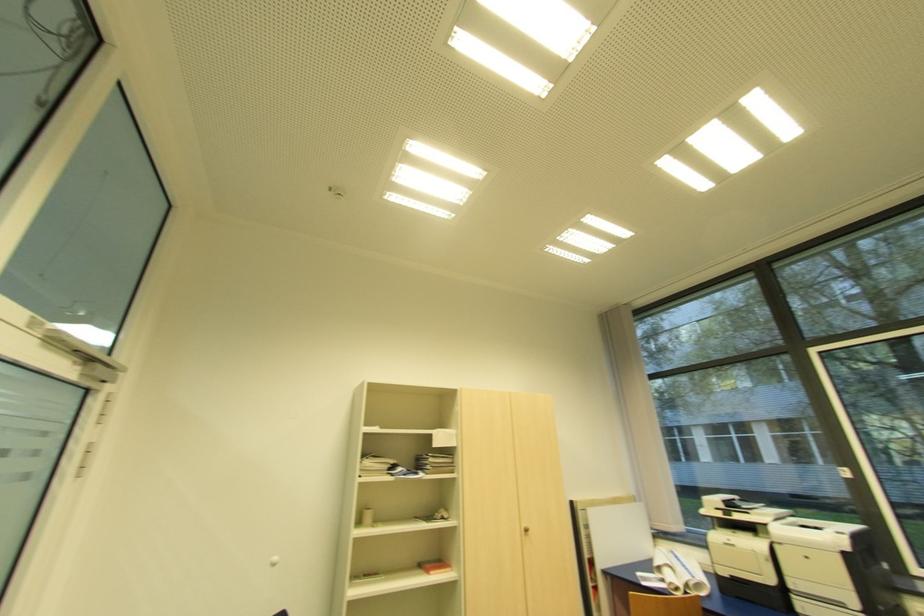
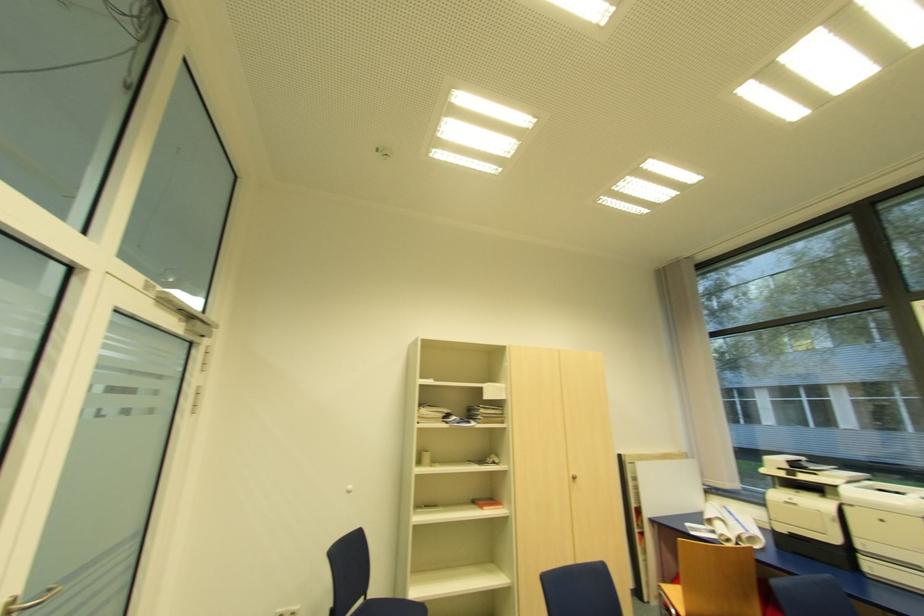
Question: Based on the continuous images, in which direction is the camera rotating? Reply with the corresponding letter.

Choices:
 (A) Left
 (B) Right
 (C) Up
 (D) Down

Answer: (A)